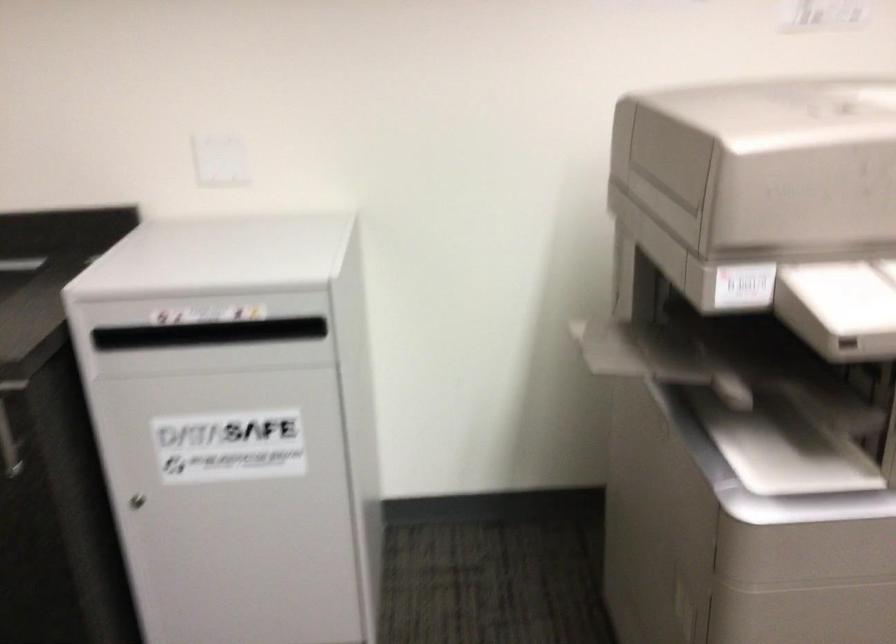
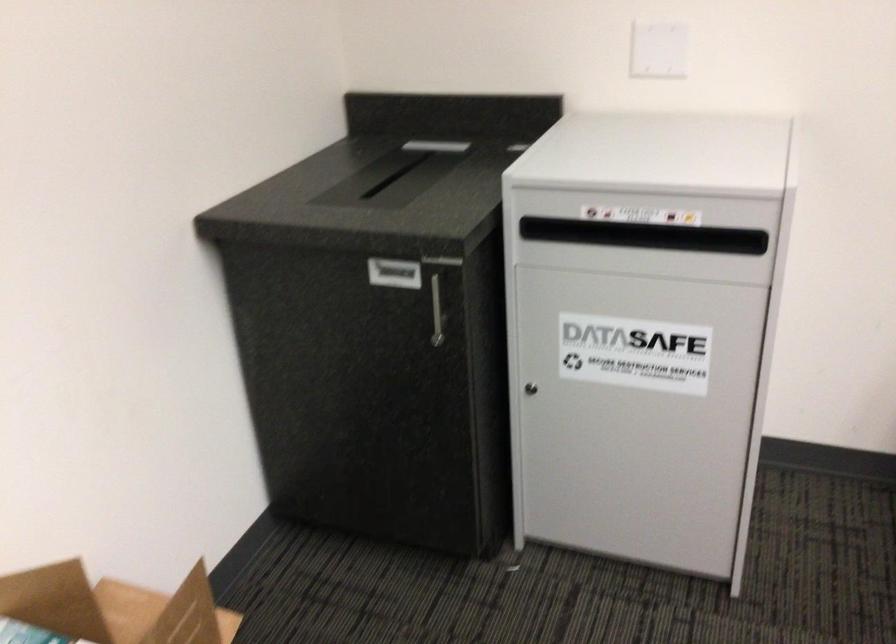
In the second image, find the point that corresponds to (243,330) in the first image.

(644, 236)